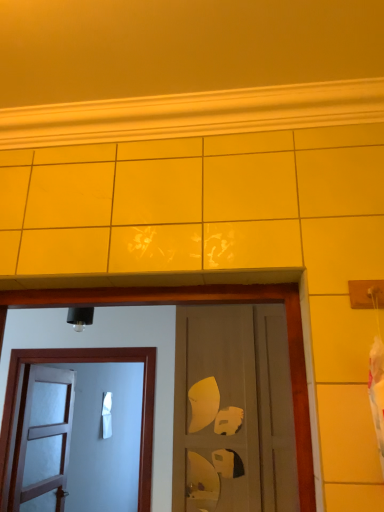
The width and height of the screenshot is (384, 512). What are the coordinates of `matte brown door at center, acting as the 1th door starting from the right` in the screenshot? It's located at (233, 411).

Find the location of a particular element. white wooden door at left, arranged as the first door when viewed from the left is located at coordinates (43, 437).

The width and height of the screenshot is (384, 512). I want to click on white matte door at left, which appears as the second door when viewed from the right, so click(x=110, y=346).

You are a GUI agent. You are given a task and a screenshot of the screen. Output one action in this format:
    pyautogui.click(x=<x>, y=<y>)
    Task: Click on the matte brown door at center, placed as the 3th door when sorted from left to right
    Image resolution: width=384 pixels, height=512 pixels.
    Given the screenshot: What is the action you would take?
    pyautogui.click(x=233, y=411)

Can you tell me how much white wooden door at left, placed as the third door when sorted from right to left, and matte brown door at center, acting as the 1th door starting from the right, differ in facing direction?

white wooden door at left, placed as the third door when sorted from right to left, and matte brown door at center, acting as the 1th door starting from the right, are facing 90.9 degrees away from each other.

Would you say white wooden door at left, arranged as the first door when viewed from the left, is outside matte brown door at center, placed as the 3th door when sorted from left to right?

Yes.

Which door is the 2nd one when counting from the left side of the matte brown door at center, placed as the 3th door when sorted from left to right? Please provide its 2D coordinates.

[(43, 437)]

Considering the positions of objects white wooden door at left, placed as the third door when sorted from right to left, and matte brown door at center, acting as the 1th door starting from the right, in the image provided, who is more to the left, white wooden door at left, placed as the third door when sorted from right to left, or matte brown door at center, acting as the 1th door starting from the right,?

white wooden door at left, placed as the third door when sorted from right to left.

From the image's perspective, is white matte door at left, which appears as the second door when viewed from the right, located above white wooden door at left, arranged as the first door when viewed from the left?

Yes, from the image's perspective, white matte door at left, which appears as the second door when viewed from the right, is over white wooden door at left, arranged as the first door when viewed from the left.

What's the angular difference between white matte door at left, positioned as the second door in left-to-right order, and white wooden door at left, arranged as the first door when viewed from the left,'s facing directions?

white matte door at left, positioned as the second door in left-to-right order, and white wooden door at left, arranged as the first door when viewed from the left, are facing 90.9 degrees away from each other.

Based on the photo, between white matte door at left, positioned as the second door in left-to-right order, and white wooden door at left, placed as the third door when sorted from right to left, which one is positioned behind?

white wooden door at left, placed as the third door when sorted from right to left, is behind.

This screenshot has width=384, height=512. Find the location of `the 1st door in front of the white wooden door at left, arranged as the first door when viewed from the left, starting your count from the anchor`. the 1st door in front of the white wooden door at left, arranged as the first door when viewed from the left, starting your count from the anchor is located at coordinates (110, 346).

Can you confirm if matte brown door at center, placed as the 3th door when sorted from left to right, is taller than white wooden door at left, placed as the third door when sorted from right to left?

Yes, matte brown door at center, placed as the 3th door when sorted from left to right, is taller than white wooden door at left, placed as the third door when sorted from right to left.

From the image's perspective, which one is positioned higher, matte brown door at center, placed as the 3th door when sorted from left to right, or white wooden door at left, placed as the third door when sorted from right to left?

matte brown door at center, placed as the 3th door when sorted from left to right, is shown above in the image.

Between point (206, 390) and point (38, 386), which one is positioned in front?

The point (206, 390) is closer to the camera.

Identify the location of door that is above the white matte door at left, positioned as the second door in left-to-right order (from the image's perspective). (233, 411).

From the image's perspective, who appears lower, matte brown door at center, acting as the 1th door starting from the right, or white matte door at left, positioned as the second door in left-to-right order?

white matte door at left, positioned as the second door in left-to-right order, is shown below in the image.

Which object is thinner, matte brown door at center, placed as the 3th door when sorted from left to right, or white matte door at left, which appears as the second door when viewed from the right?

white matte door at left, which appears as the second door when viewed from the right.

From a real-world perspective, who is located lower, matte brown door at center, placed as the 3th door when sorted from left to right, or white matte door at left, positioned as the second door in left-to-right order?

white matte door at left, positioned as the second door in left-to-right order, from a real-world perspective.

From the image's perspective, which is above, white matte door at left, positioned as the second door in left-to-right order, or matte brown door at center, acting as the 1th door starting from the right?

matte brown door at center, acting as the 1th door starting from the right, from the image's perspective.

Considering the positions of objects white matte door at left, which appears as the second door when viewed from the right, and matte brown door at center, placed as the 3th door when sorted from left to right, in the image provided, who is behind, white matte door at left, which appears as the second door when viewed from the right, or matte brown door at center, placed as the 3th door when sorted from left to right,?

white matte door at left, which appears as the second door when viewed from the right, is further away from the camera.

Based on the photo, between white matte door at left, positioned as the second door in left-to-right order, and matte brown door at center, placed as the 3th door when sorted from left to right, which one appears on the right side from the viewer's perspective?

Positioned to the right is matte brown door at center, placed as the 3th door when sorted from left to right.

Can you confirm if white matte door at left, positioned as the second door in left-to-right order, is taller than matte brown door at center, acting as the 1th door starting from the right?

No, white matte door at left, positioned as the second door in left-to-right order, is not taller than matte brown door at center, acting as the 1th door starting from the right.

Is white wooden door at left, placed as the third door when sorted from right to left, with white matte door at left, which appears as the second door when viewed from the right?

There is a gap between white wooden door at left, placed as the third door when sorted from right to left, and white matte door at left, which appears as the second door when viewed from the right.

In the scene shown: How many degrees apart are the facing directions of white wooden door at left, arranged as the first door when viewed from the left, and white matte door at left, positioned as the second door in left-to-right order?

They differ by 90.9 degrees in their facing directions.

Does point (75, 383) appear closer or farther from the camera than point (166, 397)?

Point (75, 383).

From a real-world perspective, between white wooden door at left, arranged as the first door when viewed from the left, and white matte door at left, positioned as the second door in left-to-right order, who is vertically lower?

white wooden door at left, arranged as the first door when viewed from the left, is physically lower.

The height and width of the screenshot is (512, 384). I want to click on door that is the 2nd one when counting downward from the matte brown door at center, placed as the 3th door when sorted from left to right (from the image's perspective), so click(x=43, y=437).

In the image, there is a white matte door at left, which appears as the second door when viewed from the right. In order to click on door below it (from a real-world perspective) in this screenshot , I will do `click(43, 437)`.

Based on the photo, when comparing their distances from white wooden door at left, arranged as the first door when viewed from the left, does matte brown door at center, acting as the 1th door starting from the right, or white matte door at left, positioned as the second door in left-to-right order, seem closer?

white matte door at left, positioned as the second door in left-to-right order, lies closer to white wooden door at left, arranged as the first door when viewed from the left, than the other object.

Looking at the image, which one is located further to white matte door at left, positioned as the second door in left-to-right order, matte brown door at center, placed as the 3th door when sorted from left to right, or white wooden door at left, placed as the third door when sorted from right to left?

white wooden door at left, placed as the third door when sorted from right to left, lies further to white matte door at left, positioned as the second door in left-to-right order, than the other object.

Considering their positions, is white matte door at left, which appears as the second door when viewed from the right, positioned closer to white wooden door at left, arranged as the first door when viewed from the left, than matte brown door at center, acting as the 1th door starting from the right?

Based on the image, white matte door at left, which appears as the second door when viewed from the right, appears to be nearer to white wooden door at left, arranged as the first door when viewed from the left.

Considering their positions, is white wooden door at left, arranged as the first door when viewed from the left, positioned further to white matte door at left, positioned as the second door in left-to-right order, than matte brown door at center, placed as the 3th door when sorted from left to right?

white wooden door at left, arranged as the first door when viewed from the left, lies further to white matte door at left, positioned as the second door in left-to-right order, than the other object.

When comparing their distances from matte brown door at center, placed as the 3th door when sorted from left to right, does white wooden door at left, placed as the third door when sorted from right to left, or white matte door at left, which appears as the second door when viewed from the right, seem further?

Based on the image, white wooden door at left, placed as the third door when sorted from right to left, appears to be further to matte brown door at center, placed as the 3th door when sorted from left to right.

Considering their positions, is white matte door at left, positioned as the second door in left-to-right order, positioned closer to matte brown door at center, acting as the 1th door starting from the right, than white wooden door at left, placed as the third door when sorted from right to left?

Among the two, white matte door at left, positioned as the second door in left-to-right order, is located nearer to matte brown door at center, acting as the 1th door starting from the right.

Find the location of a particular element. door between white wooden door at left, placed as the third door when sorted from right to left, and matte brown door at center, placed as the 3th door when sorted from left to right, in the horizontal direction is located at coordinates (110, 346).